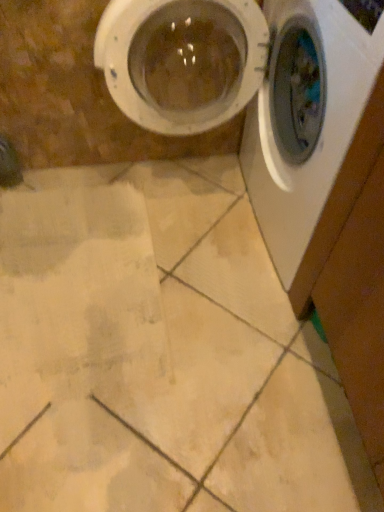
This screenshot has width=384, height=512. Find the location of `vacant area to the left of white plastic washing machine at upper right, the 2th washing machine when ordered from right to left`. vacant area to the left of white plastic washing machine at upper right, the 2th washing machine when ordered from right to left is located at coordinates (67, 237).